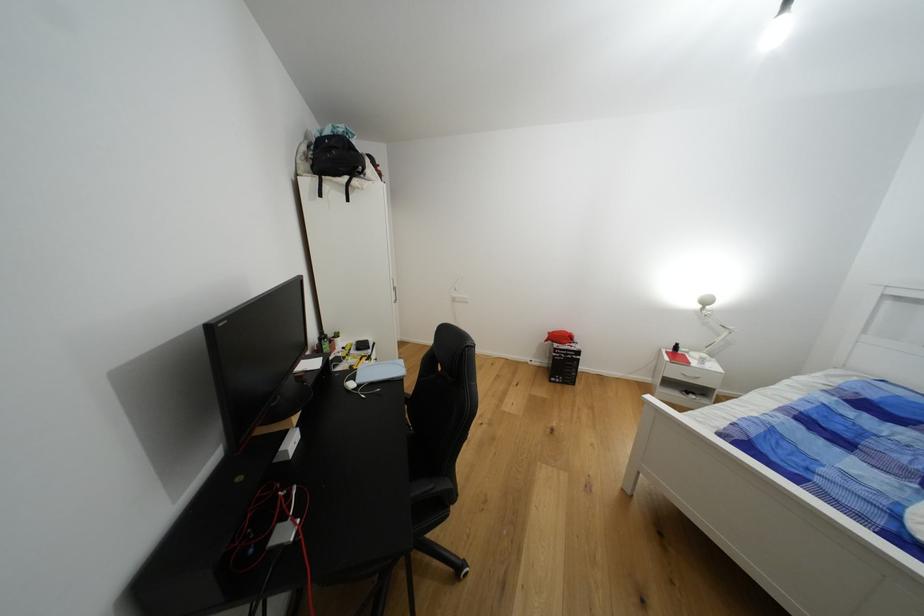
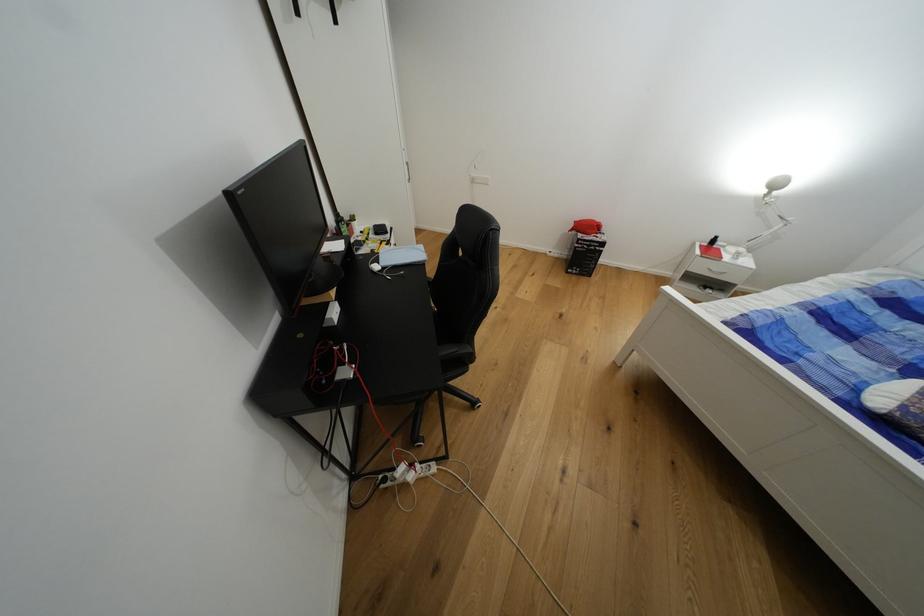
The point at (x=555, y=383) is marked in the first image. Where is the corresponding point in the second image?

(573, 274)